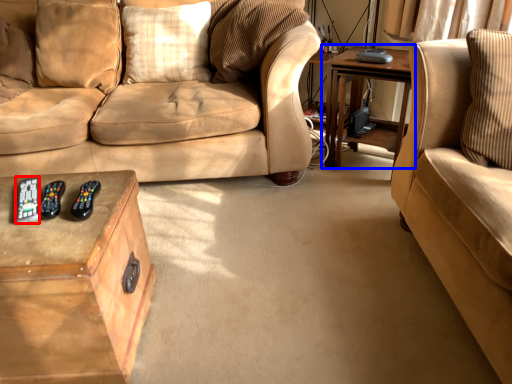
Question: Which object appears farthest to the camera in this image, remote (highlighted by a red box) or table (highlighted by a blue box)?

Choices:
 (A) remote
 (B) table

Answer: (B)